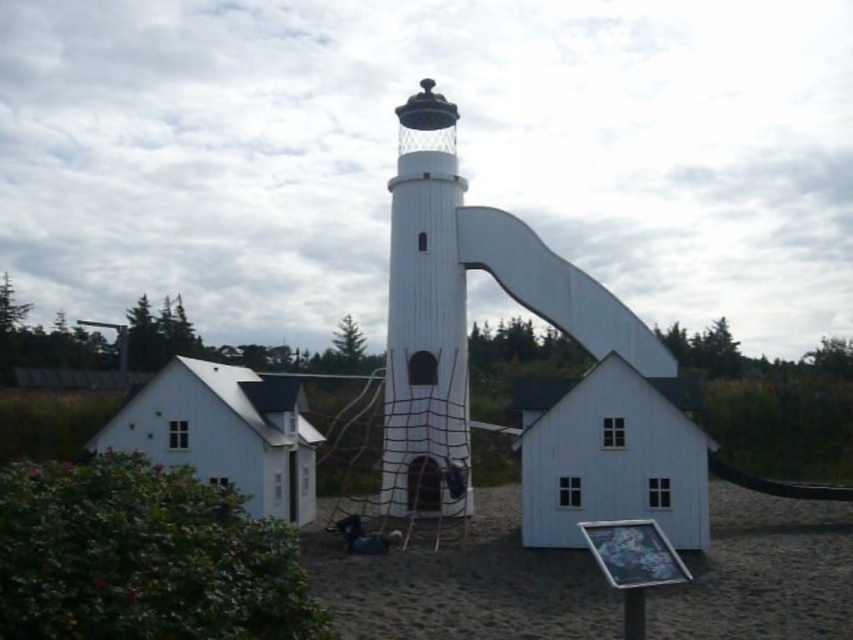
Measure the distance between brown sandy ground at center and white wood tower at center.

brown sandy ground at center is 5.67 meters from white wood tower at center.

Does brown sandy ground at center have a smaller size compared to white wood tower at center?

No.

You are a GUI agent. You are given a task and a screenshot of the screen. Output one action in this format:
    pyautogui.click(x=<x>, y=<y>)
    Task: Click on the brown sandy ground at center
    The height and width of the screenshot is (640, 853).
    Given the screenshot: What is the action you would take?
    pyautogui.click(x=463, y=584)